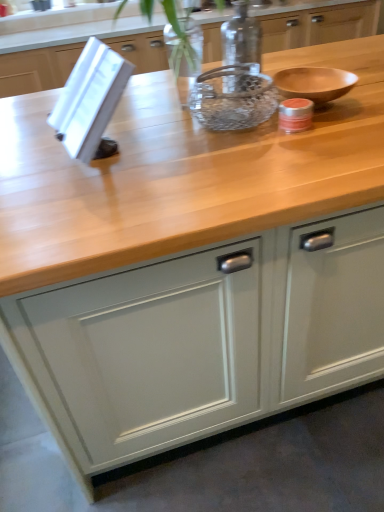
Question: From the image's perspective, is clear glass jar at center above matte gray cabinet at center?

Choices:
 (A) no
 (B) yes

Answer: (B)

Question: Does clear glass jar at center have a larger size compared to matte gray cabinet at center?

Choices:
 (A) yes
 (B) no

Answer: (B)

Question: Can you confirm if clear glass jar at center is smaller than matte gray cabinet at center?

Choices:
 (A) yes
 (B) no

Answer: (A)

Question: Could you tell me if clear glass jar at center is facing matte gray cabinet at center?

Choices:
 (A) no
 (B) yes

Answer: (A)

Question: Does clear glass jar at center have a lesser height compared to matte gray cabinet at center?

Choices:
 (A) no
 (B) yes

Answer: (B)

Question: In the image, is matte gray cabinet at center positioned in front of or behind clear glass bowl at center?

Choices:
 (A) front
 (B) behind

Answer: (A)

Question: Is point click(168, 334) closer or farther from the camera than point click(205, 74)?

Choices:
 (A) farther
 (B) closer

Answer: (B)

Question: From a real-world perspective, relative to clear glass bowl at center, is matte gray cabinet at center vertically above or below?

Choices:
 (A) above
 (B) below

Answer: (B)

Question: Which is correct: matte gray cabinet at center is inside clear glass bowl at center, or outside of it?

Choices:
 (A) outside
 (B) inside

Answer: (A)

Question: From the image's perspective, is clear glass jar at center located above or below clear glass bowl at center?

Choices:
 (A) below
 (B) above

Answer: (B)

Question: In terms of height, does clear glass jar at center look taller or shorter compared to clear glass bowl at center?

Choices:
 (A) tall
 (B) short

Answer: (A)

Question: Considering the positions of point (243, 72) and point (258, 110), is point (243, 72) closer or farther from the camera than point (258, 110)?

Choices:
 (A) farther
 (B) closer

Answer: (A)

Question: Considering their positions, is clear glass jar at center located in front of or behind clear glass bowl at center?

Choices:
 (A) front
 (B) behind

Answer: (B)

Question: From a real-world perspective, is clear glass jar at center above or below matte gray cabinet at center?

Choices:
 (A) below
 (B) above

Answer: (B)

Question: Relative to matte gray cabinet at center, is clear glass jar at center in front or behind?

Choices:
 (A) behind
 (B) front

Answer: (A)